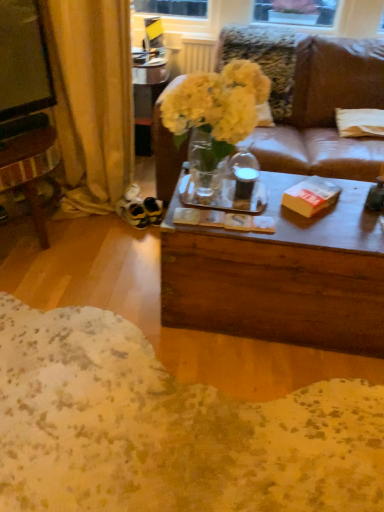
Question: Is the depth of translucent glass vase at center less than that of yellow paper book at center?

Choices:
 (A) yes
 (B) no

Answer: (B)

Question: Would you say translucent glass vase at center is outside yellow paper book at center?

Choices:
 (A) no
 (B) yes

Answer: (B)

Question: Is translucent glass vase at center surrounding yellow paper book at center?

Choices:
 (A) no
 (B) yes

Answer: (A)

Question: Is translucent glass vase at center positioned behind yellow paper book at center?

Choices:
 (A) yes
 (B) no

Answer: (A)

Question: Is translucent glass vase at center wider than yellow paper book at center?

Choices:
 (A) yes
 (B) no

Answer: (A)

Question: From a real-world perspective, is translucent glass vase at center positioned under yellow paper book at center based on gravity?

Choices:
 (A) yes
 (B) no

Answer: (A)

Question: Considering the relative positions of translucent glass vase at center and white fabric pillow at right in the image provided, is translucent glass vase at center behind white fabric pillow at right?

Choices:
 (A) no
 (B) yes

Answer: (A)

Question: Does translucent glass vase at center have a larger size compared to white fabric pillow at right?

Choices:
 (A) yes
 (B) no

Answer: (A)

Question: Is translucent glass vase at center at the left side of white fabric pillow at right?

Choices:
 (A) no
 (B) yes

Answer: (B)

Question: Is translucent glass vase at center facing towards white fabric pillow at right?

Choices:
 (A) yes
 (B) no

Answer: (B)

Question: From a real-world perspective, is translucent glass vase at center on top of white fabric pillow at right?

Choices:
 (A) no
 (B) yes

Answer: (B)

Question: Is translucent glass vase at center placed right next to white fabric pillow at right?

Choices:
 (A) yes
 (B) no

Answer: (B)

Question: Can you confirm if white fabric pillow at right is thinner than translucent glass vase at center?

Choices:
 (A) yes
 (B) no

Answer: (B)